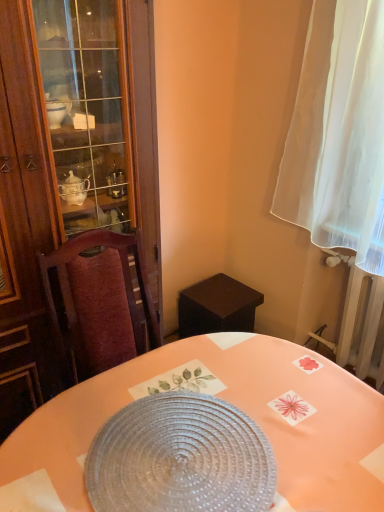
Consider the image. Measure the distance between point (x=246, y=400) and camera.

A distance of 99.70 centimeters exists between point (x=246, y=400) and camera.

What do you see at coordinates (233, 404) in the screenshot? I see `clear plastic placemat at center` at bounding box center [233, 404].

In order to click on clear plastic placemat at center in this screenshot , I will do `click(233, 404)`.

In order to face clear plastic placemat at center, should I rotate leftwards or rightwards?

To align with it, rotate left about 0.889°.

This screenshot has height=512, width=384. I want to click on clear plastic placemat at center, so click(233, 404).